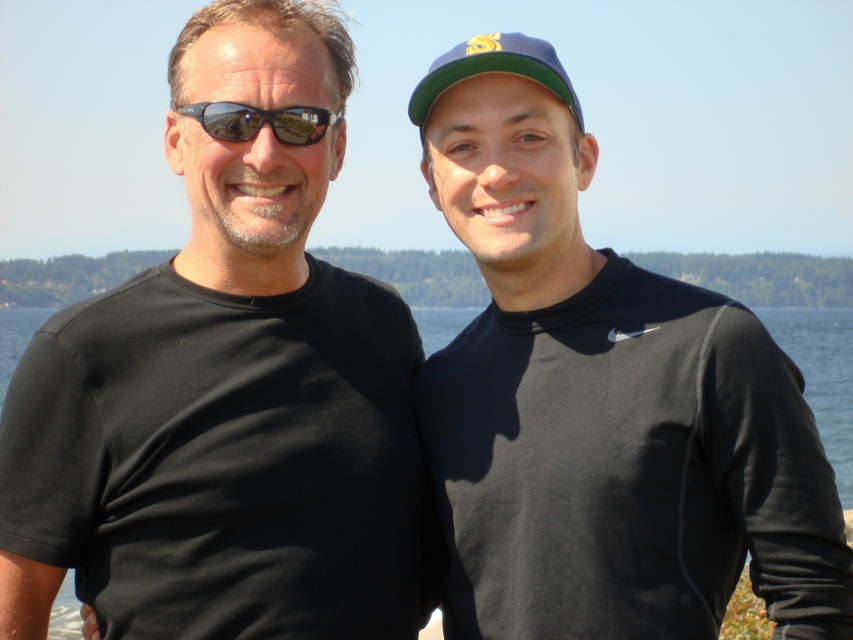
Which is behind, point (436, 308) or point (566, 93)?

Positioned behind is point (436, 308).

Does transparent water at center have a greater width compared to green fabric baseball cap at upper center?

Yes.

Does point (26, 312) lie behind point (512, 58)?

Yes, it is behind point (512, 58).

Locate an element on the screen. The image size is (853, 640). transparent water at center is located at coordinates (822, 376).

What do you see at coordinates (822, 376) in the screenshot? This screenshot has height=640, width=853. I see `transparent water at center` at bounding box center [822, 376].

Where is `transparent water at center`? transparent water at center is located at coordinates (822, 376).

Can you confirm if black matte shirt at right is taller than transparent water at center?

No.

Which of these two, black matte shirt at right or transparent water at center, stands taller?

transparent water at center is taller.

Image resolution: width=853 pixels, height=640 pixels. Describe the element at coordinates (601, 401) in the screenshot. I see `black matte shirt at right` at that location.

Locate an element on the screen. black matte shirt at right is located at coordinates (601, 401).